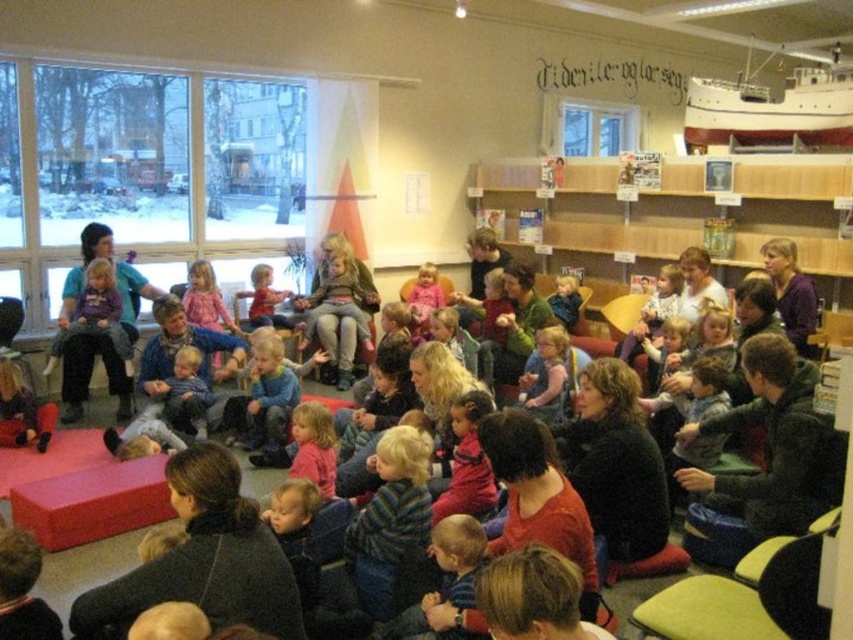
Can you confirm if dark green sweater at lower right is positioned to the right of black matte jacket at center?

Correct, you'll find dark green sweater at lower right to the right of black matte jacket at center.

Which is behind, point (781, 451) or point (618, 556)?

The point (618, 556) is behind.

Which is in front, point (804, 528) or point (631, 438)?

Point (804, 528) is in front.

What are the coordinates of `dark green sweater at lower right` in the screenshot? It's located at (775, 445).

What do you see at coordinates (618, 474) in the screenshot? The height and width of the screenshot is (640, 853). I see `black matte jacket at center` at bounding box center [618, 474].

Who is positioned more to the left, black matte jacket at center or blue denim pants at center?

From the viewer's perspective, blue denim pants at center appears more on the left side.

Measure the distance between point (648, 460) and camera.

A distance of 3.07 meters exists between point (648, 460) and camera.

At what (x,y) coordinates should I click in order to perform the action: click on black matte jacket at center. Please return your answer as a coordinate pair (x, y). Looking at the image, I should click on click(x=618, y=474).

Does matte pink sweater at center appear under blue denim pants at center?

Incorrect, matte pink sweater at center is not positioned below blue denim pants at center.

Between matte pink sweater at center and blue denim pants at center, which one has more height?

matte pink sweater at center is taller.

Identify the location of matte pink sweater at center. This screenshot has width=853, height=640. (546, 376).